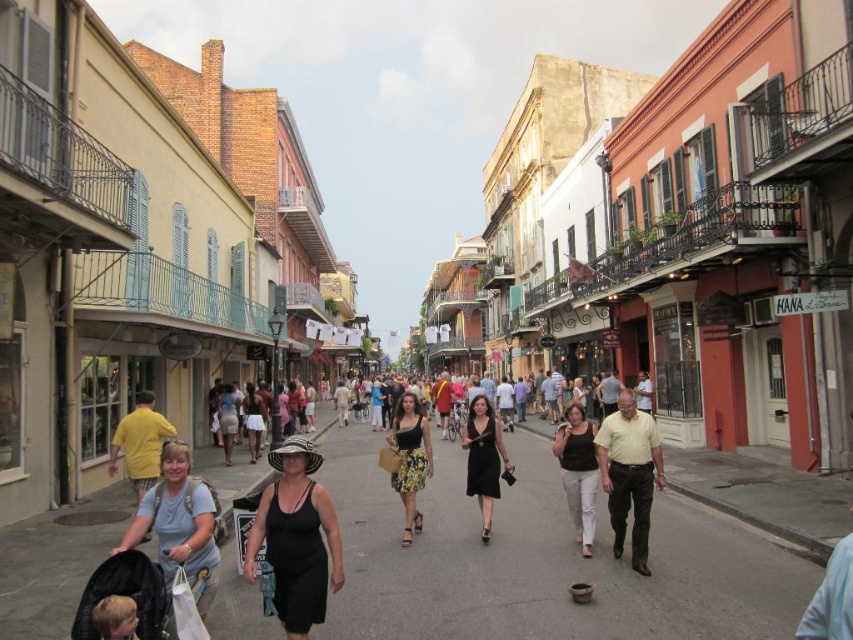
You are a photographer standing in the middle of the street. You notice a person wearing a yellow cotton shirt at center and another wearing a dark brown textured dress at center. Which clothing item is visible above the other?

The yellow cotton shirt at center is positioned over the dark brown textured dress at center, making it visible above the other.

You are standing at the entrance of a historic district street in New Orleans. You need to find the gray asphalt pavement at center. According to the coordinates provided, where exactly is it located?

The gray asphalt pavement at center is located at coordinates point (543, 561).